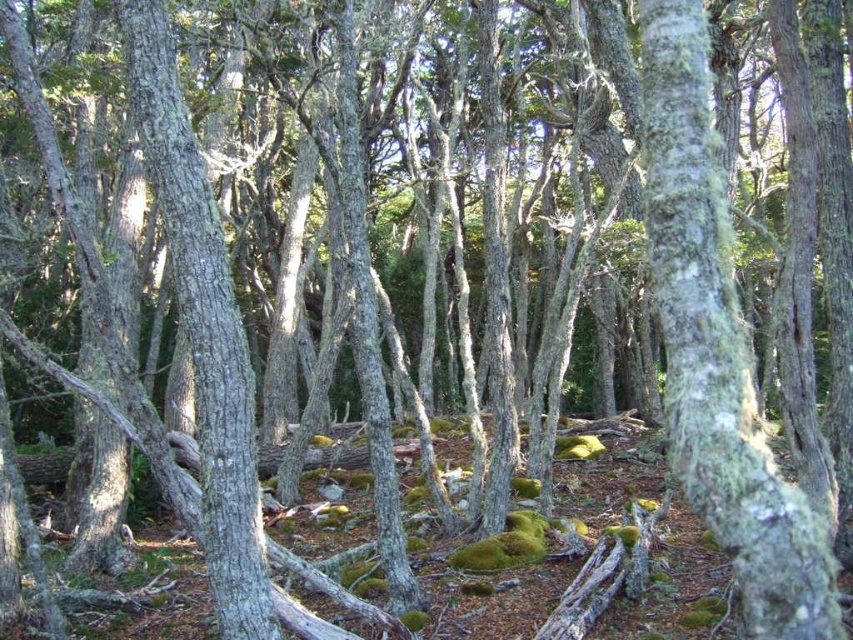
Question: Can you confirm if green mossy bark tree trunk at center is positioned to the right of smooth gray bark at center?

Choices:
 (A) yes
 (B) no

Answer: (A)

Question: Can you confirm if green mossy bark tree trunk at center is positioned above smooth gray bark at center?

Choices:
 (A) yes
 (B) no

Answer: (A)

Question: Does green mossy bark tree trunk at center have a lesser width compared to smooth gray bark at center?

Choices:
 (A) yes
 (B) no

Answer: (B)

Question: Among these objects, which one is nearest to the camera?

Choices:
 (A) green mossy bark tree trunk at center
 (B) smooth gray bark at center

Answer: (A)